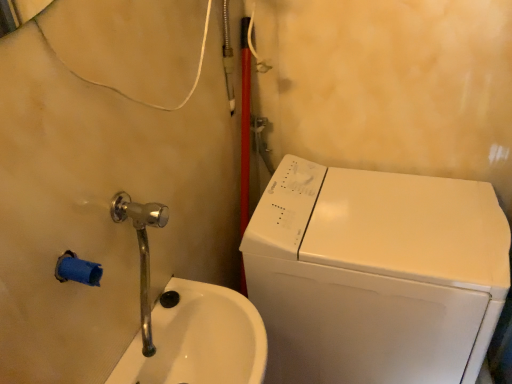
Question: Is polished chrome faucet at lower left bigger or smaller than white glossy washing machine at right?

Choices:
 (A) small
 (B) big

Answer: (A)

Question: From a real-world perspective, is polished chrome faucet at lower left physically located above or below white glossy washing machine at right?

Choices:
 (A) above
 (B) below

Answer: (A)

Question: Considering the real-world distances, which object is farthest from the white glossy sink at lower left?

Choices:
 (A) white glossy washing machine at right
 (B) polished chrome faucet at lower left

Answer: (A)

Question: Which object is positioned closest to the white glossy sink at lower left?

Choices:
 (A) polished chrome faucet at lower left
 (B) white glossy washing machine at right

Answer: (A)